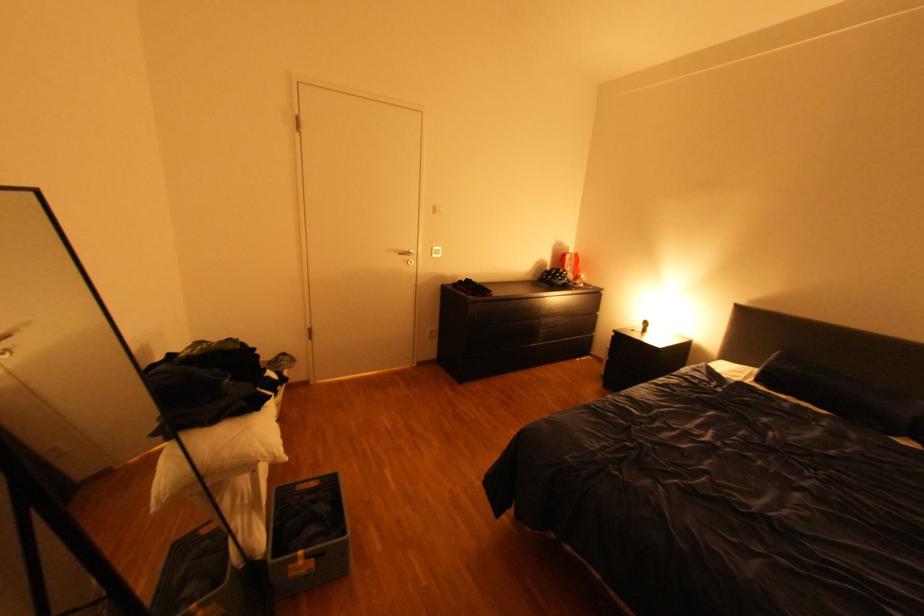
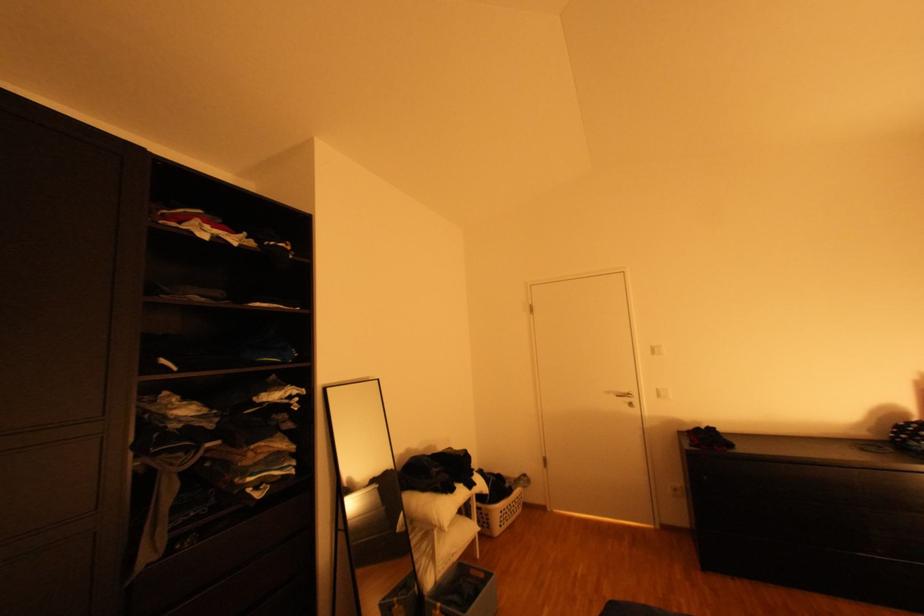
Where in the second image is the point corresponding to (487,317) from the first image?

(715, 477)